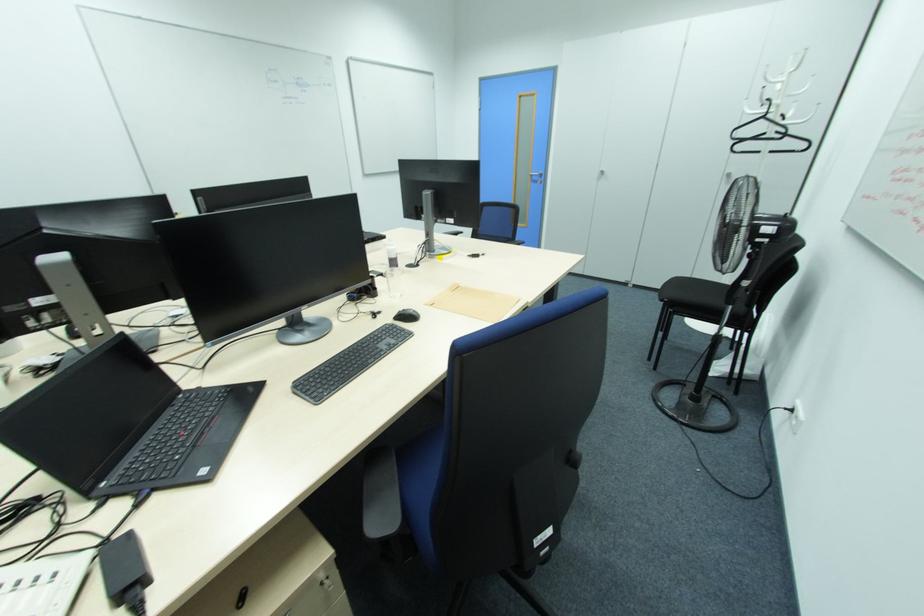
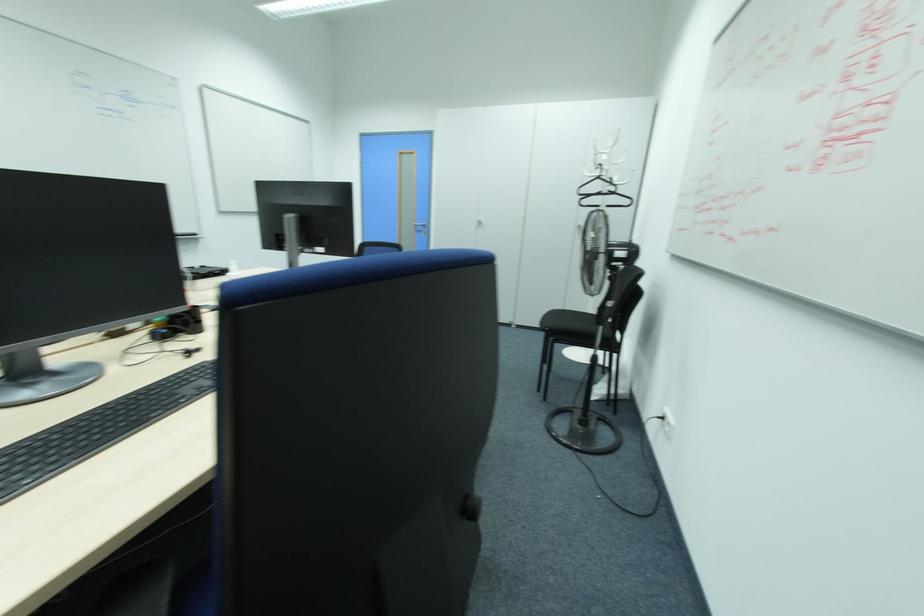
Question: Based on the continuous images, in which direction is the camera rotating? Reply with the corresponding letter.

Choices:
 (A) Left
 (B) Right
 (C) Up
 (D) Down

Answer: (B)